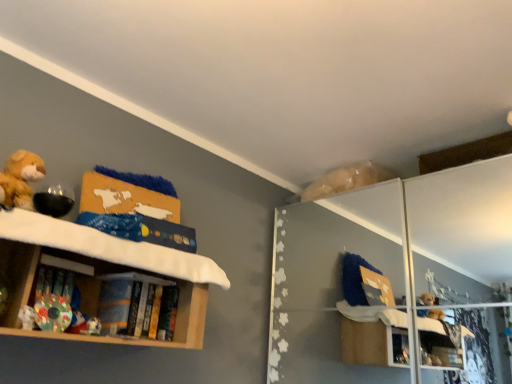
Question: From the image's perspective, does hardcover book at center, which is counted as the 2th book, starting from the front, appear lower than transparent glass door at upper right?

Choices:
 (A) yes
 (B) no

Answer: (B)

Question: Can you see hardcover book at center, which is counted as the 2th book, starting from the front, touching transparent glass door at upper right?

Choices:
 (A) no
 (B) yes

Answer: (A)

Question: Is hardcover book at center, the first book positioned from the right, smaller than transparent glass door at upper right?

Choices:
 (A) no
 (B) yes

Answer: (B)

Question: Is hardcover book at center, which is counted as the 2th book, starting from the front, thinner than transparent glass door at upper right?

Choices:
 (A) yes
 (B) no

Answer: (A)

Question: Considering the relative sizes of hardcover book at center, which is the 1th book in back-to-front order, and transparent glass door at upper right in the image provided, is hardcover book at center, which is the 1th book in back-to-front order, wider than transparent glass door at upper right?

Choices:
 (A) yes
 (B) no

Answer: (B)

Question: Is hardcover book at center, arranged as the 2th book when viewed from the left, bigger than transparent glass door at upper right?

Choices:
 (A) yes
 (B) no

Answer: (B)

Question: From the image's perspective, would you say white plush toy at lower left is positioned over multicolored fabric book at lower left, which is the 2th book from right to left?

Choices:
 (A) no
 (B) yes

Answer: (B)

Question: Considering the relative sizes of white plush toy at lower left and multicolored fabric book at lower left, placed as the 2th book when sorted from back to front, in the image provided, is white plush toy at lower left smaller than multicolored fabric book at lower left, placed as the 2th book when sorted from back to front,?

Choices:
 (A) yes
 (B) no

Answer: (A)

Question: Can you confirm if white plush toy at lower left is taller than multicolored fabric book at lower left, placed as the 2th book when sorted from back to front?

Choices:
 (A) yes
 (B) no

Answer: (B)

Question: Considering the relative positions of white plush toy at lower left and multicolored fabric book at lower left, which is the 2th book from right to left, in the image provided, is white plush toy at lower left to the left of multicolored fabric book at lower left, which is the 2th book from right to left, from the viewer's perspective?

Choices:
 (A) yes
 (B) no

Answer: (A)

Question: Is white plush toy at lower left positioned beyond the bounds of multicolored fabric book at lower left, placed as the 2th book when sorted from back to front?

Choices:
 (A) yes
 (B) no

Answer: (A)

Question: From the image's perspective, is white plush toy at lower left below multicolored fabric book at lower left, placed as the 2th book when sorted from back to front?

Choices:
 (A) no
 (B) yes

Answer: (A)

Question: Can you confirm if hardcover book at center, arranged as the 2th book when viewed from the left, is positioned to the left of wooden bookshelf at left?

Choices:
 (A) yes
 (B) no

Answer: (B)